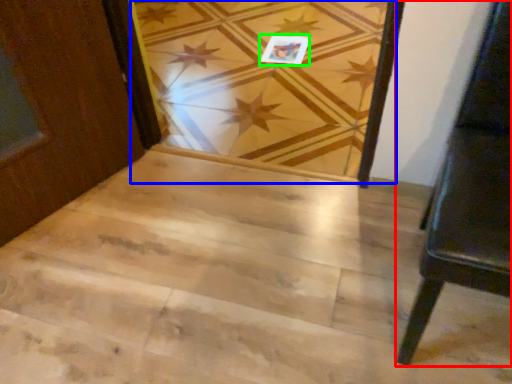
Question: Considering the real-world distances, which object is closest to furniture (highlighted by a red box)? plank (highlighted by a blue box) or postcard (highlighted by a green box).

Choices:
 (A) plank
 (B) postcard

Answer: (A)